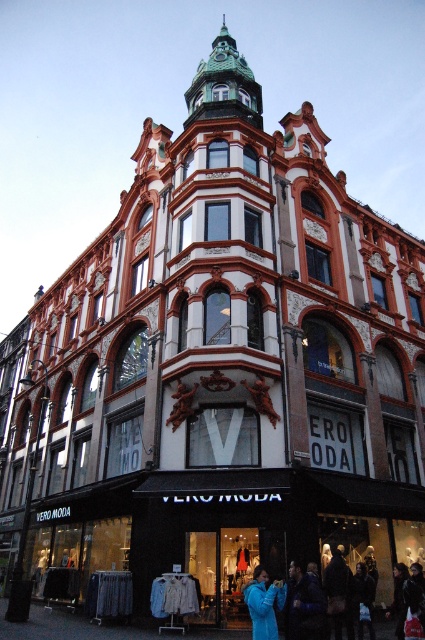
Does dark blue jacket at lower center appear on the right side of blue fleece jacket at lower center?

Correct, you'll find dark blue jacket at lower center to the right of blue fleece jacket at lower center.

Which is more to the left, dark blue jacket at lower center or blue fleece jacket at lower center?

blue fleece jacket at lower center is more to the left.

What do you see at coordinates (303, 605) in the screenshot? Image resolution: width=425 pixels, height=640 pixels. I see `dark blue jacket at lower center` at bounding box center [303, 605].

At what (x,y) coordinates should I click in order to perform the action: click on dark blue jacket at lower center. Please return your answer as a coordinate pair (x, y). The width and height of the screenshot is (425, 640). Looking at the image, I should click on (303, 605).